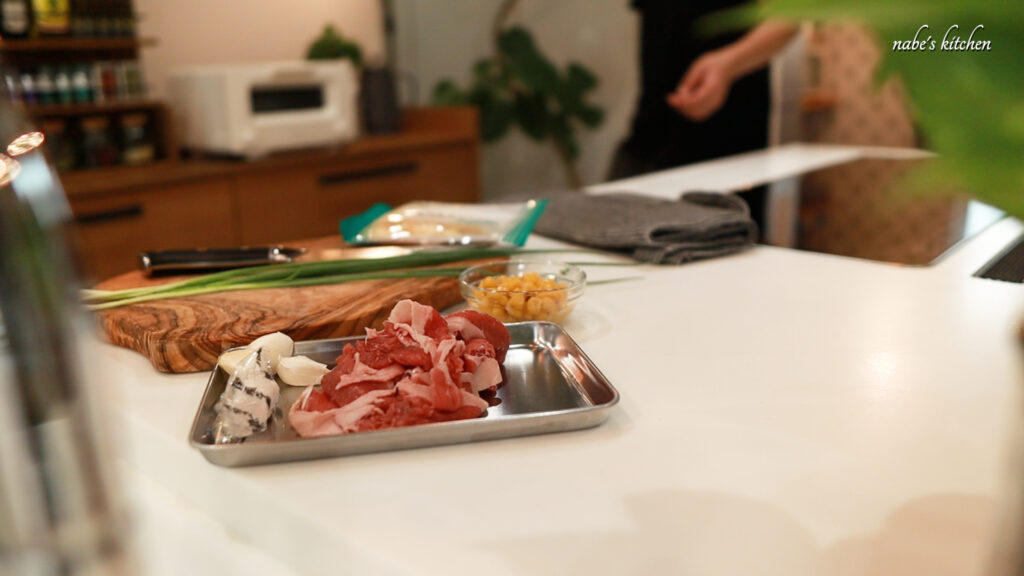
Find the location of a particular element. grey metal tray is located at coordinates (524, 396).